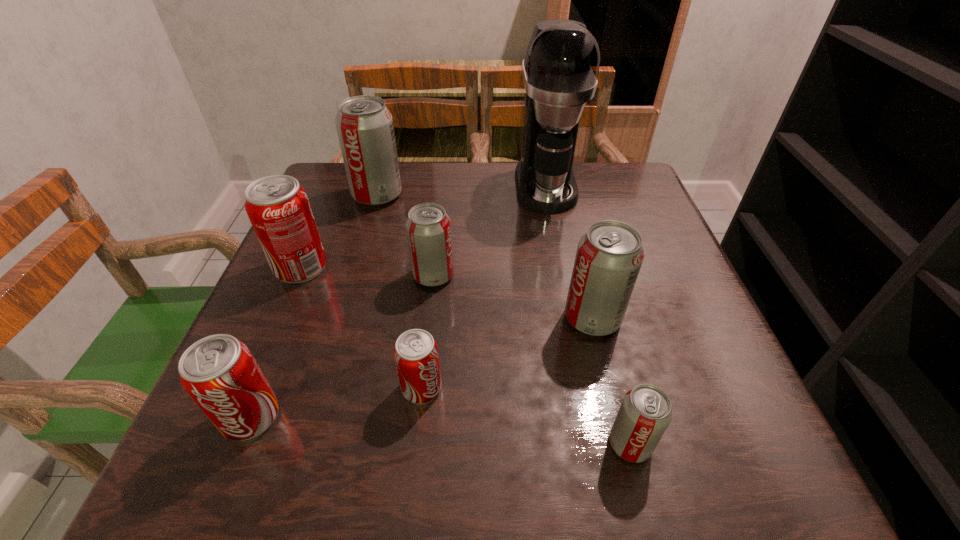
Where is `vacant point located between the second biggest gray soda can and the third nearest gray soda can`? The width and height of the screenshot is (960, 540). vacant point located between the second biggest gray soda can and the third nearest gray soda can is located at coordinates (513, 296).

I want to click on free space that is in between the tallest object and the rightmost red soda can, so click(484, 287).

Locate an element on the screen. The height and width of the screenshot is (540, 960). free point between the third farthest gray soda can and the tallest object is located at coordinates (569, 252).

The image size is (960, 540). I want to click on vacant area that lies between the second biggest red soda can and the smallest red soda can, so click(x=336, y=402).

Identify the location of vacant area that lies between the second gray soda can from left to right and the rightmost red soda can. (427, 332).

The image size is (960, 540). What are the coordinates of `vacant area between the farthest red soda can and the second smallest red soda can` in the screenshot? It's located at (276, 342).

Identify the location of vacant area between the second farthest gray soda can and the coffee maker. (490, 231).

I want to click on empty location between the farthest gray soda can and the smallest red soda can, so [x=399, y=292].

The image size is (960, 540). I want to click on vacant area that lies between the leftmost gray soda can and the rightmost red soda can, so click(x=399, y=292).

Identify the location of vacant space that is in between the nearest gray soda can and the leftmost gray soda can. [x=504, y=320].